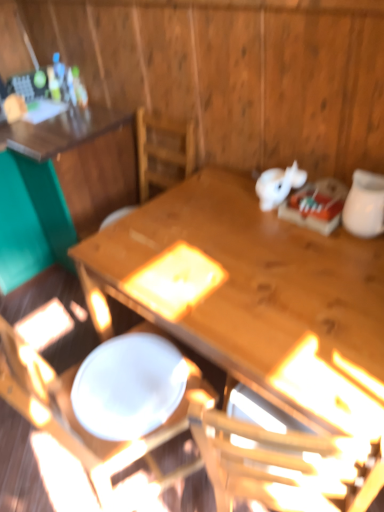
Where is `vacant space situated above wooden table at upper left, the 1th table when ordered from left to right (from a real-world perspective)`? vacant space situated above wooden table at upper left, the 1th table when ordered from left to right (from a real-world perspective) is located at coordinates (55, 122).